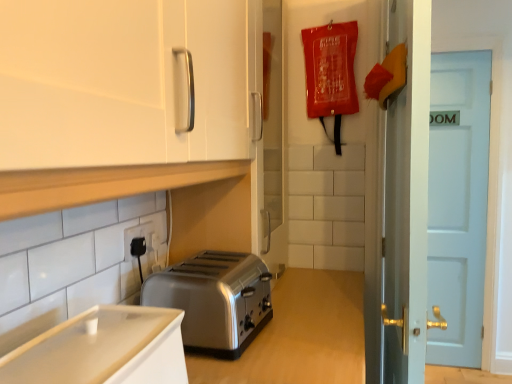
Question: Are white glossy cabinet at lower left, the second cabinetry viewed from the top, and white wooden door at right located far from each other?

Choices:
 (A) yes
 (B) no

Answer: (A)

Question: Is the depth of white glossy cabinet at lower left, the first cabinetry when ordered from bottom to top, greater than that of white wooden door at right?

Choices:
 (A) no
 (B) yes

Answer: (A)

Question: Is white wooden door at right completely or partially inside white glossy cabinet at lower left, the second cabinetry viewed from the top?

Choices:
 (A) no
 (B) yes

Answer: (A)

Question: From a real-world perspective, is white glossy cabinet at lower left, the second cabinetry viewed from the top, on white wooden door at right?

Choices:
 (A) no
 (B) yes

Answer: (B)

Question: From the image's perspective, is white glossy cabinet at lower left, the second cabinetry viewed from the top, on white wooden door at right?

Choices:
 (A) no
 (B) yes

Answer: (A)

Question: Is white glossy cabinet at lower left, the second cabinetry viewed from the top, taller or shorter than black plastic electric outlet at lower left?

Choices:
 (A) tall
 (B) short

Answer: (A)

Question: From the image's perspective, relative to black plastic electric outlet at lower left, is white glossy cabinet at lower left, the second cabinetry viewed from the top, above or below?

Choices:
 (A) below
 (B) above

Answer: (A)

Question: Do you think white glossy cabinet at lower left, the second cabinetry viewed from the top, is within black plastic electric outlet at lower left, or outside of it?

Choices:
 (A) outside
 (B) inside

Answer: (A)

Question: Relative to black plastic electric outlet at lower left, is white glossy cabinet at lower left, the first cabinetry when ordered from bottom to top, in front or behind?

Choices:
 (A) behind
 (B) front

Answer: (B)

Question: From a real-world perspective, is satin silver toaster at lower center above or below white glossy cabinet at lower left, the second cabinetry viewed from the top?

Choices:
 (A) below
 (B) above

Answer: (A)

Question: From the image's perspective, is satin silver toaster at lower center positioned above or below white glossy cabinet at lower left, the second cabinetry viewed from the top?

Choices:
 (A) above
 (B) below

Answer: (A)

Question: Is satin silver toaster at lower center spatially inside white glossy cabinet at lower left, the second cabinetry viewed from the top, or outside of it?

Choices:
 (A) outside
 (B) inside

Answer: (A)

Question: Is satin silver toaster at lower center to the left or to the right of white glossy cabinet at lower left, the second cabinetry viewed from the top, in the image?

Choices:
 (A) right
 (B) left

Answer: (A)

Question: From the image's perspective, relative to satin silver toaster at lower center, is white wooden door at right above or below?

Choices:
 (A) above
 (B) below

Answer: (A)

Question: Considering their positions, is white wooden door at right located in front of or behind satin silver toaster at lower center?

Choices:
 (A) front
 (B) behind

Answer: (B)